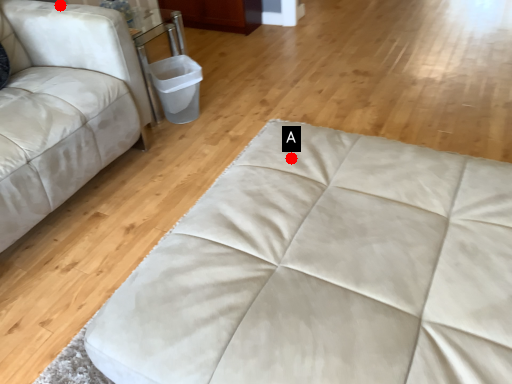
Question: Two points are circled on the image, labeled by A and B beside each circle. Which point appears farthest from the camera in this image?

Choices:
 (A) A is further
 (B) B is further

Answer: (B)